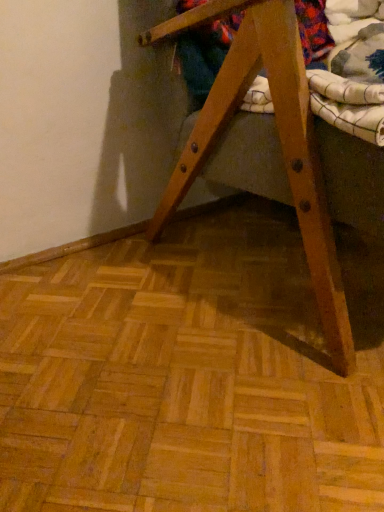
Question: Considering the positions of floral fabric at upper right and wooden folding chair at center in the image, is floral fabric at upper right wider or thinner than wooden folding chair at center?

Choices:
 (A) wide
 (B) thin

Answer: (B)

Question: In terms of size, does floral fabric at upper right appear bigger or smaller than wooden folding chair at center?

Choices:
 (A) big
 (B) small

Answer: (B)

Question: Is point [x=307, y=9] closer or farther from the camera than point [x=312, y=258]?

Choices:
 (A) farther
 (B) closer

Answer: (A)

Question: Is wooden folding chair at center wider or thinner than floral fabric at upper right?

Choices:
 (A) wide
 (B) thin

Answer: (A)

Question: From their relative heights in the image, would you say wooden folding chair at center is taller or shorter than floral fabric at upper right?

Choices:
 (A) short
 (B) tall

Answer: (B)

Question: From a real-world perspective, relative to floral fabric at upper right, is wooden folding chair at center vertically above or below?

Choices:
 (A) above
 (B) below

Answer: (B)

Question: In the image, is wooden folding chair at center on the left side or the right side of floral fabric at upper right?

Choices:
 (A) left
 (B) right

Answer: (B)